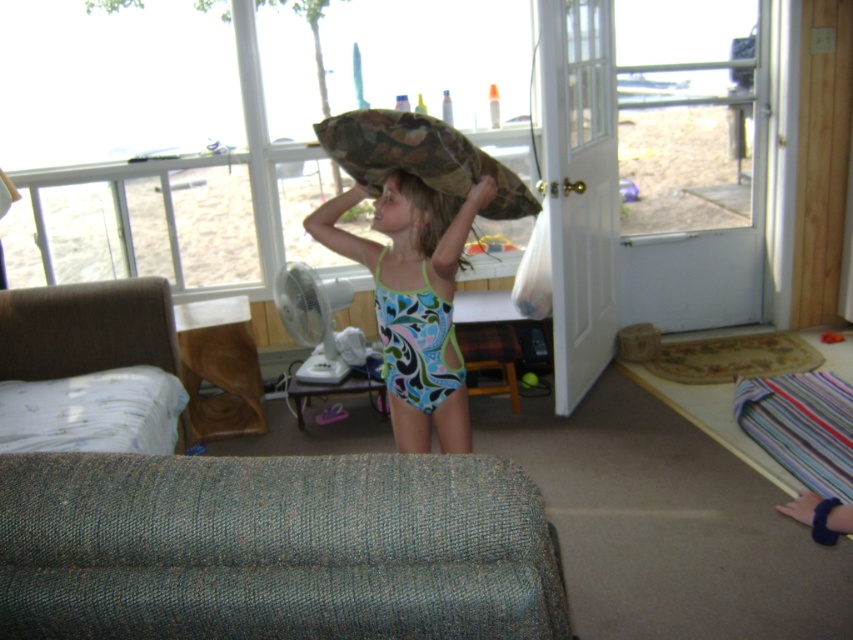
Question: Does blue printed swimsuit at center have a smaller size compared to blue-green swimsuit at center?

Choices:
 (A) no
 (B) yes

Answer: (A)

Question: Estimate the real-world distances between objects in this image. Which object is closer to the blue printed swimsuit at center?

Choices:
 (A) white wood screen door at right
 (B) camouflage fabric pillow at center

Answer: (B)

Question: Considering the relative positions of white wood screen door at right and blue-green swimsuit at center in the image provided, where is white wood screen door at right located with respect to blue-green swimsuit at center?

Choices:
 (A) below
 (B) above

Answer: (B)

Question: In this image, where is white wood screen door at right located relative to camouflage fabric pillow at center?

Choices:
 (A) above
 (B) below

Answer: (A)

Question: Among these points, which one is farthest from the camera?

Choices:
 (A) 611,228
 (B) 375,132

Answer: (A)

Question: Which point is closer to the camera taking this photo?

Choices:
 (A) (572, 268)
 (B) (424, 211)
 (C) (413, 172)
 (D) (474, 214)

Answer: (C)